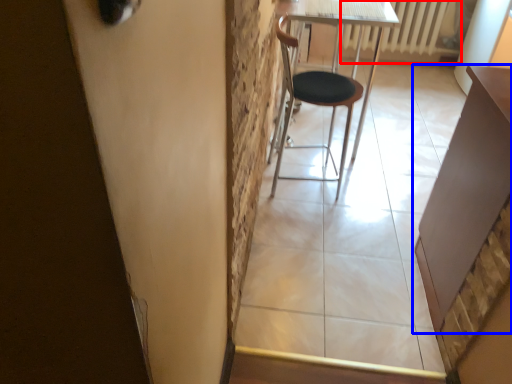
Question: Which of the following is the closest to the observer, radiator (highlighted by a red box) or table (highlighted by a blue box)?

Choices:
 (A) radiator
 (B) table

Answer: (B)